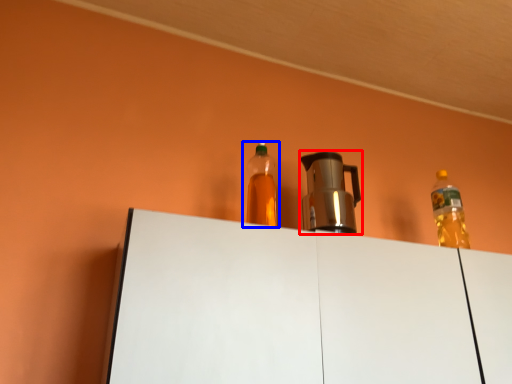
Question: Which object is further to the camera taking this photo, coffeepot (highlighted by a red box) or bottle (highlighted by a blue box)?

Choices:
 (A) coffeepot
 (B) bottle

Answer: (A)